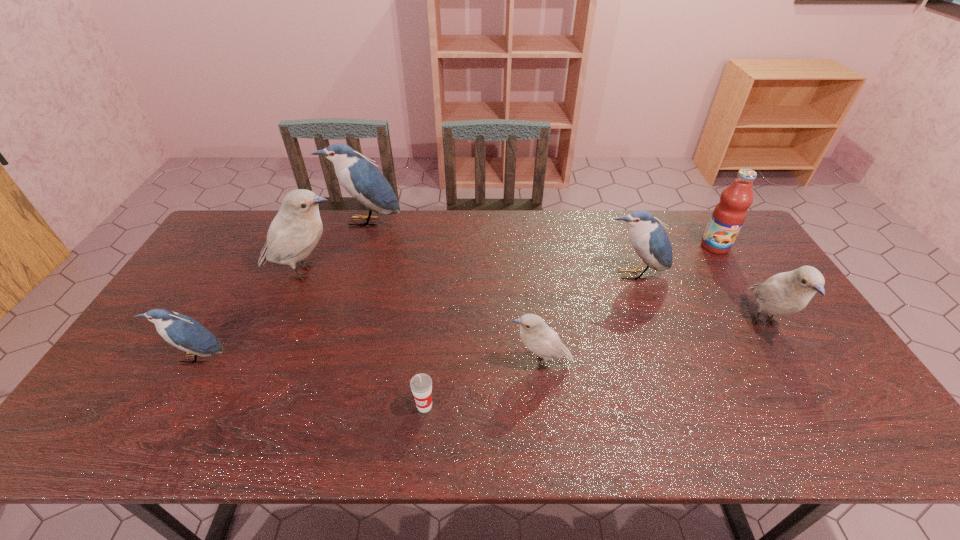
You are a GUI agent. You are given a task and a screenshot of the screen. Output one action in this format:
    pyautogui.click(x=<x>, y=<y>)
    Task: Click on the bird that is at the right edge
    The height and width of the screenshot is (540, 960).
    Given the screenshot: What is the action you would take?
    pyautogui.click(x=786, y=293)

This screenshot has width=960, height=540. Identify the location of object present at the far right corner. (728, 216).

The height and width of the screenshot is (540, 960). In order to click on vacant space at the far edge of the desktop in this screenshot , I will do `click(489, 244)`.

Find the location of a particular element. This screenshot has height=540, width=960. vacant space at the near edge of the desktop is located at coordinates (472, 435).

Where is `vacant area at the left edge of the desktop`? vacant area at the left edge of the desktop is located at coordinates (180, 293).

Locate an element on the screen. The height and width of the screenshot is (540, 960). vacant space at the far left corner is located at coordinates (243, 234).

At what (x,y) coordinates should I click in order to perform the action: click on free space that is in between the leftmost white bird and the smallest blue bird. Please return your answer as a coordinate pair (x, y). Looking at the image, I should click on (251, 315).

This screenshot has height=540, width=960. I want to click on free space between the rightmost bird and the rightmost blue bird, so tap(699, 299).

Locate an element on the screen. This screenshot has height=540, width=960. free space between the fruit juice and the nearest blue bird is located at coordinates (456, 302).

Locate an element on the screen. vacant region between the leftmost white bird and the rightmost bird is located at coordinates (535, 297).